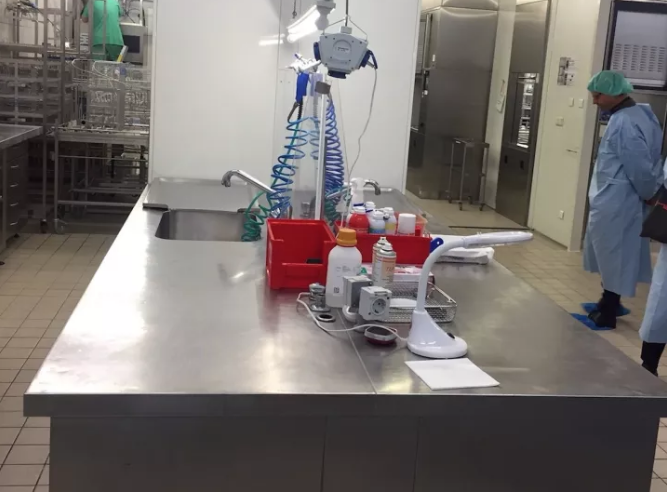
The width and height of the screenshot is (667, 492). What are the coordinates of `faucet` in the screenshot? It's located at [227, 175], [373, 183].